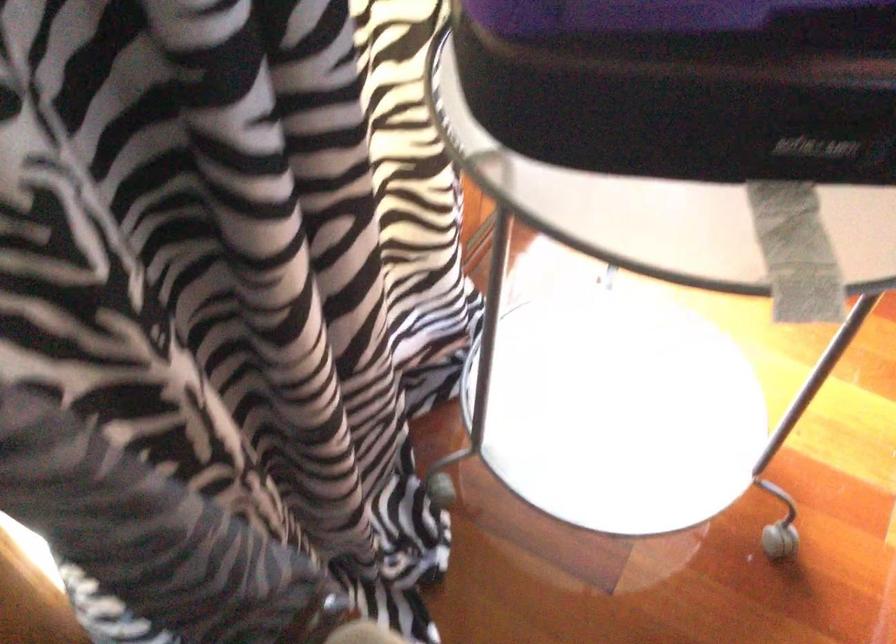
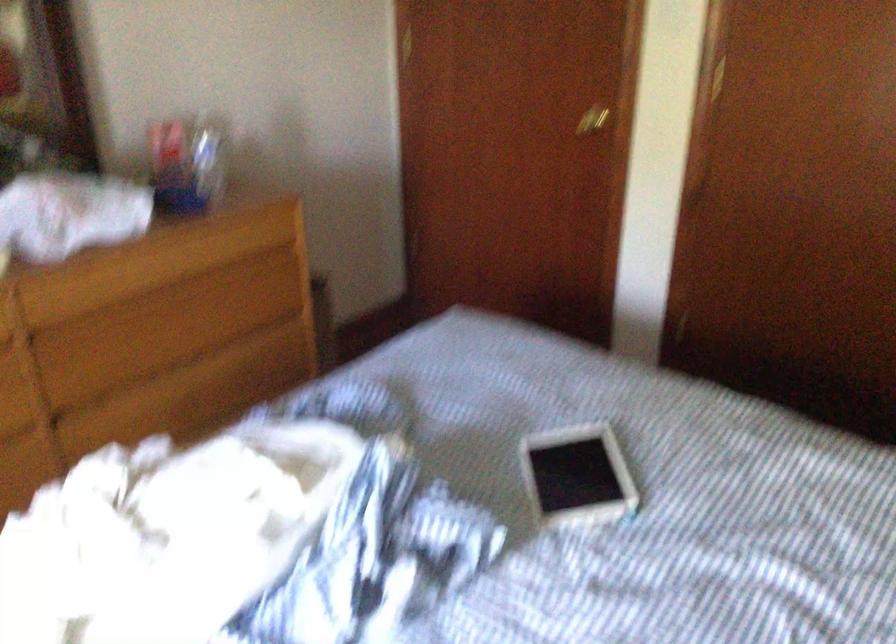
Question: Based on the continuous images, in which direction is the camera rotating? Reply with the corresponding letter.

Choices:
 (A) Left
 (B) Right
 (C) Up
 (D) Down

Answer: (B)